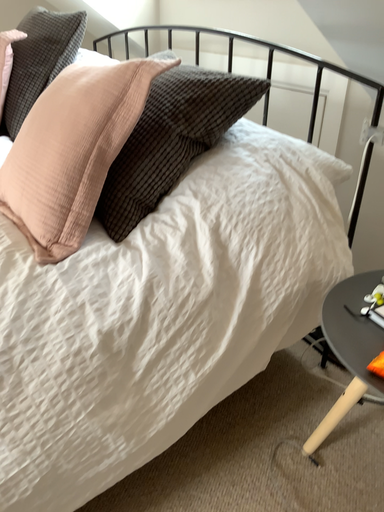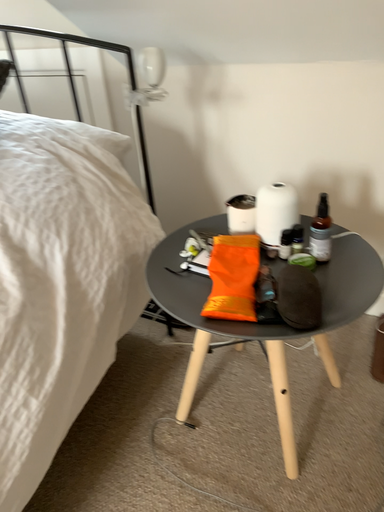
Question: How did the camera likely rotate when shooting the video?

Choices:
 (A) rotated right
 (B) rotated left

Answer: (A)